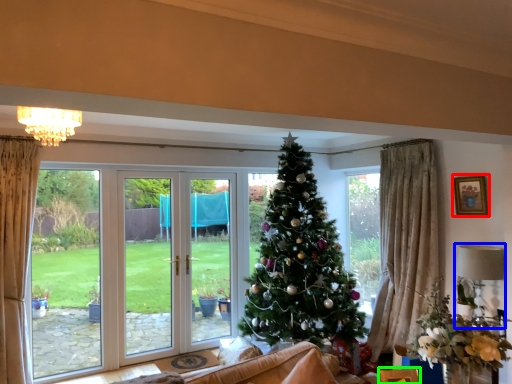
Question: Which object is positioned farthest from picture frame (highlighted by a red box)? Select from lamp (highlighted by a blue box) and furniture (highlighted by a green box).

Choices:
 (A) lamp
 (B) furniture

Answer: (B)